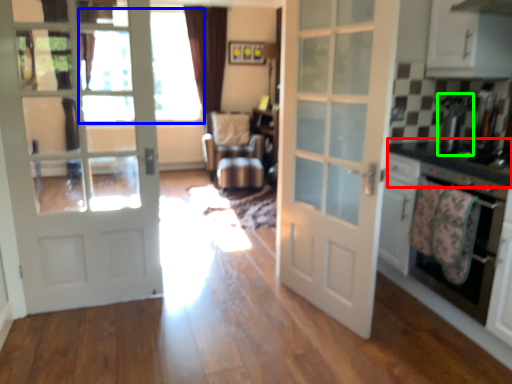
Question: Based on their relative distances, which object is nearer to counter top (highlighted by a red box)? Choose from window screen (highlighted by a blue box) and appliance (highlighted by a green box).

Choices:
 (A) window screen
 (B) appliance

Answer: (B)